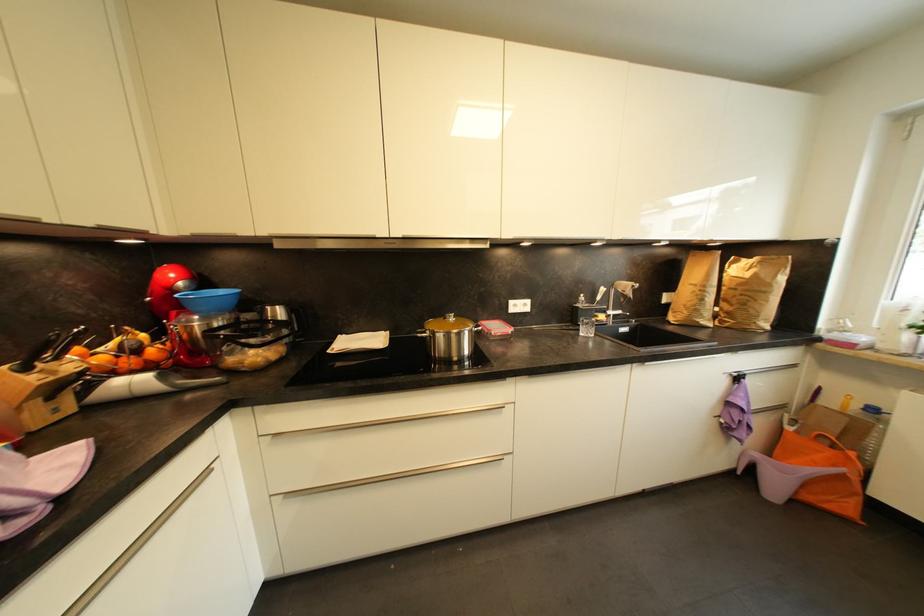
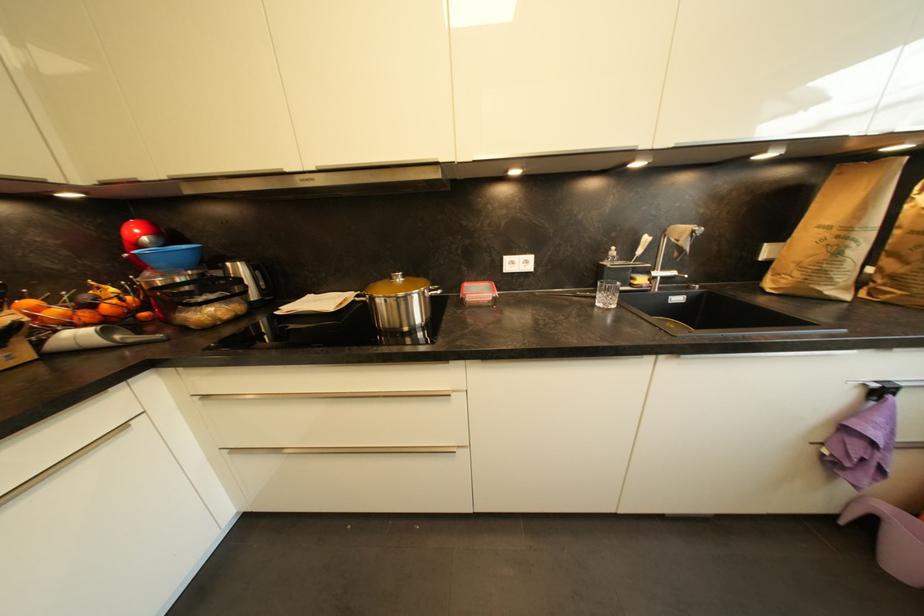
Which direction would the cameraman need to move to produce the second image?

The cameraman moved toward right, forward.